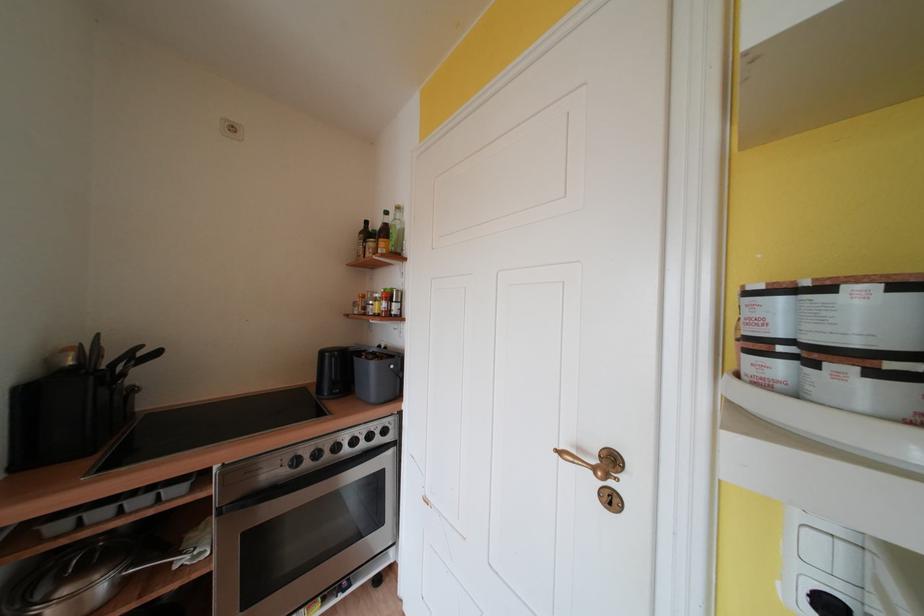
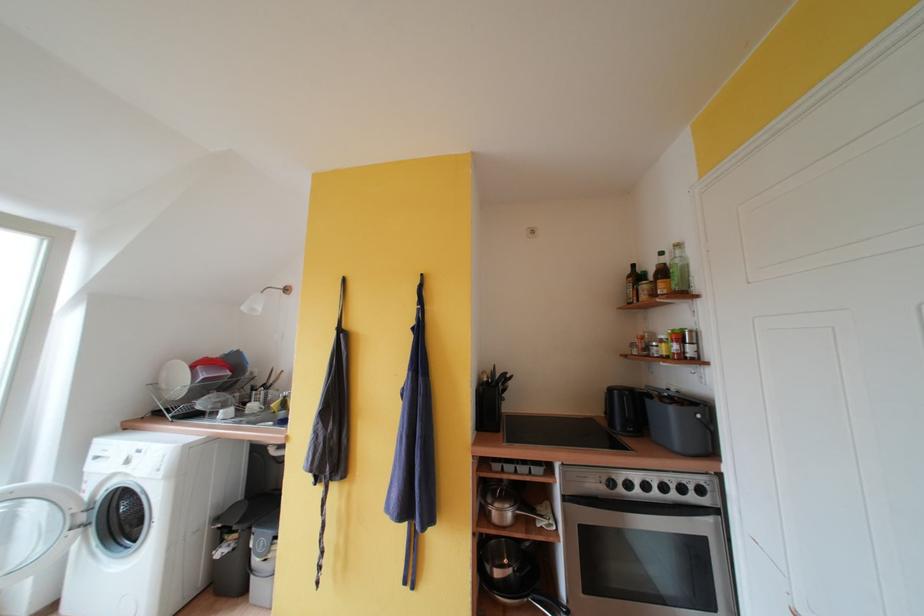
In the second image, find the point that corresponds to [312,459] in the first image.

(626, 485)